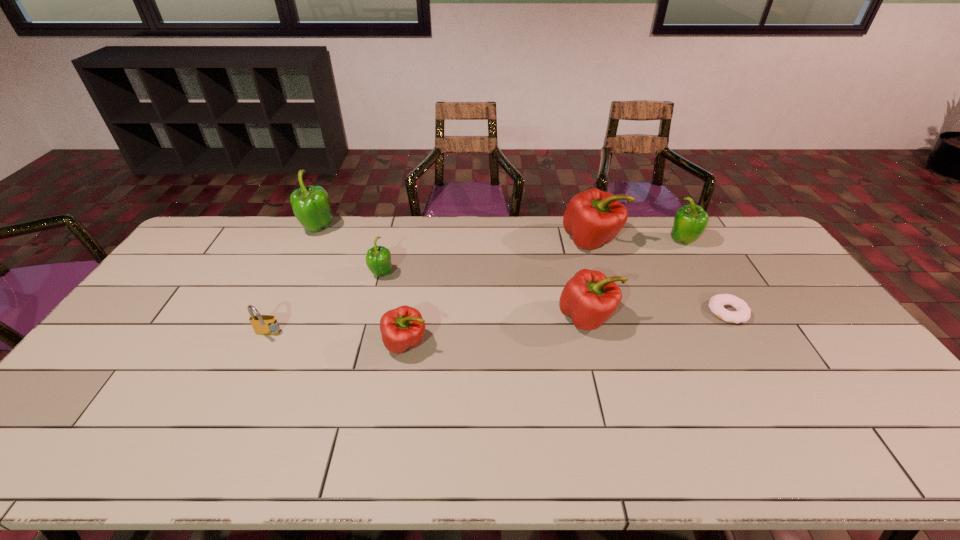
Locate an element on the screen. Image resolution: width=960 pixels, height=540 pixels. free space at the far edge of the desktop is located at coordinates (660, 242).

In the image, there is a desktop. Where is `vacant space at the near edge`? vacant space at the near edge is located at coordinates 209,436.

The image size is (960, 540). In the image, there is a desktop. In order to click on free space at the left edge in this screenshot , I will do `click(169, 317)`.

You are a GUI agent. You are given a task and a screenshot of the screen. Output one action in this format:
    pyautogui.click(x=<x>, y=<y>)
    Task: Click on the free spot at the right edge of the desktop
    
    Given the screenshot: What is the action you would take?
    pyautogui.click(x=758, y=271)

Find the location of `free space between the padlock and the shortest object`. free space between the padlock and the shortest object is located at coordinates (497, 323).

You are a GUI agent. You are given a task and a screenshot of the screen. Output one action in this format:
    pyautogui.click(x=<x>, y=<y>)
    Task: Click on the empty space between the biggest pink bell pepper and the biggest green bell pepper
    Image resolution: width=960 pixels, height=540 pixels.
    Given the screenshot: What is the action you would take?
    coord(455,235)

In order to click on vacant point located between the second smallest pink bell pepper and the leftmost pink bell pepper in this screenshot , I will do `click(496, 331)`.

This screenshot has width=960, height=540. I want to click on blank region between the fourth farthest object and the doughnut, so click(555, 293).

You are a GUI agent. You are given a task and a screenshot of the screen. Output one action in this format:
    pyautogui.click(x=<x>, y=<y>)
    Task: Click on the empty location between the second green bell pepper from right to left and the leftmost pink bell pepper
    
    Given the screenshot: What is the action you would take?
    pyautogui.click(x=394, y=309)

I want to click on free spot between the farthest pink bell pepper and the doughnut, so click(660, 276).